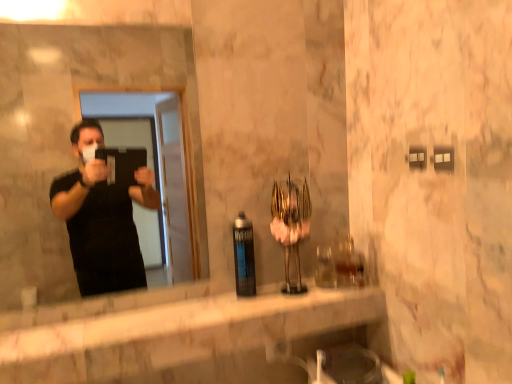
Question: Does matte black mirror at left have a greater width compared to white marble counter at center?

Choices:
 (A) no
 (B) yes

Answer: (A)

Question: Is matte black mirror at left oriented towards white marble counter at center?

Choices:
 (A) no
 (B) yes

Answer: (A)

Question: Can white marble counter at center be found inside matte black mirror at left?

Choices:
 (A) no
 (B) yes

Answer: (A)

Question: Does matte black mirror at left appear on the left side of white marble counter at center?

Choices:
 (A) yes
 (B) no

Answer: (A)

Question: From the image's perspective, does matte black mirror at left appear lower than white marble counter at center?

Choices:
 (A) yes
 (B) no

Answer: (B)

Question: Is matte black mirror at left further to camera compared to white marble counter at center?

Choices:
 (A) no
 (B) yes

Answer: (B)

Question: Considering the relative sizes of matte black spray can at center and white marble counter at center in the image provided, is matte black spray can at center taller than white marble counter at center?

Choices:
 (A) no
 (B) yes

Answer: (B)

Question: Is matte black spray can at center aimed at white marble counter at center?

Choices:
 (A) no
 (B) yes

Answer: (A)

Question: Is matte black spray can at center smaller than white marble counter at center?

Choices:
 (A) no
 (B) yes

Answer: (B)

Question: Is matte black spray can at center behind white marble counter at center?

Choices:
 (A) no
 (B) yes

Answer: (B)

Question: Can we say matte black spray can at center lies outside white marble counter at center?

Choices:
 (A) yes
 (B) no

Answer: (A)

Question: Considering the relative sizes of matte black spray can at center and white marble counter at center in the image provided, is matte black spray can at center shorter than white marble counter at center?

Choices:
 (A) yes
 (B) no

Answer: (B)

Question: Is the position of matte black mirror at left less distant than that of matte black spray can at center?

Choices:
 (A) yes
 (B) no

Answer: (A)